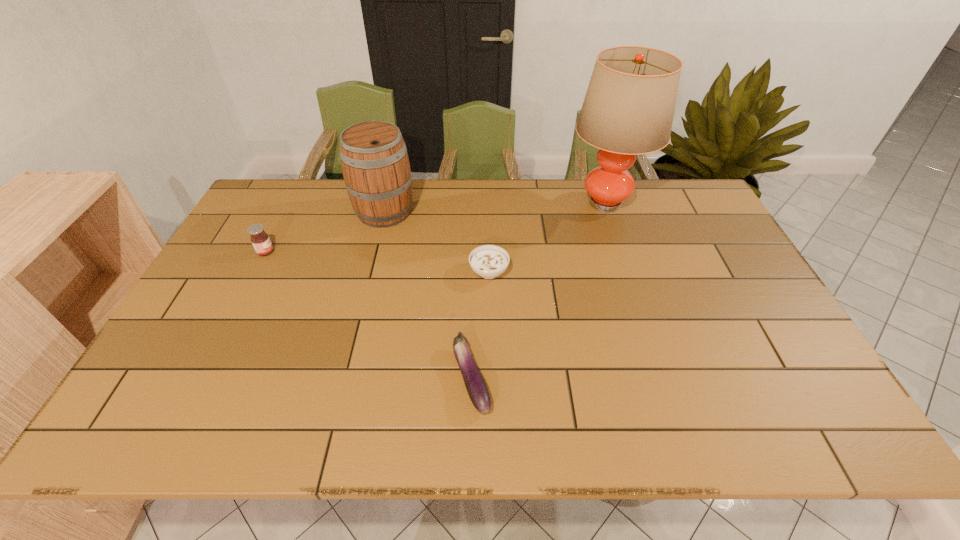
Where is `free space at the right edge of the desktop`? This screenshot has height=540, width=960. free space at the right edge of the desktop is located at coordinates (755, 282).

In the image, there is a desktop. Where is `vacant space at the far left corner`? This screenshot has height=540, width=960. vacant space at the far left corner is located at coordinates (276, 205).

Image resolution: width=960 pixels, height=540 pixels. I want to click on vacant area that lies between the soup bowl and the eggplant, so click(480, 325).

Find the location of a particular element. free space that is in between the soup bowl and the eggplant is located at coordinates (480, 325).

At what (x,y) coordinates should I click in order to perform the action: click on free space between the nearest object and the fourth shortest object. Please return your answer as a coordinate pair (x, y). Image resolution: width=960 pixels, height=540 pixels. Looking at the image, I should click on (428, 295).

Where is `free spot between the tallest object and the eggplant`? The width and height of the screenshot is (960, 540). free spot between the tallest object and the eggplant is located at coordinates (539, 290).

In order to click on blank region between the fourth farthest object and the tallest object in this screenshot , I will do `click(547, 237)`.

Image resolution: width=960 pixels, height=540 pixels. Find the location of `unoccupied area between the tallest object and the third nearest object`. unoccupied area between the tallest object and the third nearest object is located at coordinates (436, 227).

Where is `free space between the soup bowl and the eggplant`? The width and height of the screenshot is (960, 540). free space between the soup bowl and the eggplant is located at coordinates (480, 325).

This screenshot has height=540, width=960. What are the coordinates of `free point between the nearest object and the second object from left to right` in the screenshot? It's located at (428, 295).